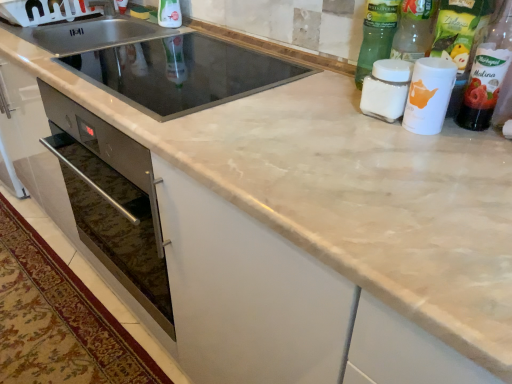
Question: Can translucent plastic bottle at upper right, which is the 1th bottle from right to left, be found inside black glass sink at center, the first sink in the front-to-back sequence?

Choices:
 (A) no
 (B) yes

Answer: (A)

Question: Is black glass sink at center, positioned as the 2th sink in back-to-front order, further to the viewer compared to translucent plastic bottle at upper right, which is the 1th bottle from right to left?

Choices:
 (A) no
 (B) yes

Answer: (B)

Question: Can you confirm if black glass sink at center, the first sink in the front-to-back sequence, is thinner than translucent plastic bottle at upper right, which is the 1th bottle from right to left?

Choices:
 (A) yes
 (B) no

Answer: (B)

Question: Does black glass sink at center, the first sink in the front-to-back sequence, have a smaller size compared to translucent plastic bottle at upper right, placed as the sixth bottle when sorted from left to right?

Choices:
 (A) no
 (B) yes

Answer: (A)

Question: Is black glass sink at center, the first sink in the front-to-back sequence, turned away from translucent plastic bottle at upper right, placed as the sixth bottle when sorted from left to right?

Choices:
 (A) yes
 (B) no

Answer: (B)

Question: From their relative heights in the image, would you say white matte cup at upper right, marked as the 4th bottle in a left-to-right arrangement, is taller or shorter than transparent plastic bottle at upper center, the first bottle when ordered from left to right?

Choices:
 (A) short
 (B) tall

Answer: (A)

Question: Looking at their shapes, would you say white matte cup at upper right, marked as the 4th bottle in a left-to-right arrangement, is wider or thinner than transparent plastic bottle at upper center, which appears as the 6th bottle when viewed from the right?

Choices:
 (A) thin
 (B) wide

Answer: (A)

Question: In the image, is white matte cup at upper right, marked as the 4th bottle in a left-to-right arrangement, on the left side or the right side of transparent plastic bottle at upper center, the first bottle when ordered from left to right?

Choices:
 (A) right
 (B) left

Answer: (A)

Question: Is white matte cup at upper right, marked as the 4th bottle in a left-to-right arrangement, in front of or behind transparent plastic bottle at upper center, the first bottle when ordered from left to right, in the image?

Choices:
 (A) front
 (B) behind

Answer: (A)

Question: Would you say green glass bottle at upper right, positioned as the fourth bottle in right-to-left order, is inside or outside transparent plastic bottle at upper center, the first bottle when ordered from left to right?

Choices:
 (A) inside
 (B) outside

Answer: (B)

Question: Considering the relative positions of green glass bottle at upper right, positioned as the fourth bottle in right-to-left order, and transparent plastic bottle at upper center, the first bottle when ordered from left to right, in the image provided, is green glass bottle at upper right, positioned as the fourth bottle in right-to-left order, to the left or to the right of transparent plastic bottle at upper center, the first bottle when ordered from left to right,?

Choices:
 (A) right
 (B) left

Answer: (A)

Question: Is green glass bottle at upper right, the 3th bottle positioned from the left, in front of or behind transparent plastic bottle at upper center, the first bottle when ordered from left to right, in the image?

Choices:
 (A) front
 (B) behind

Answer: (A)

Question: From a real-world perspective, is green glass bottle at upper right, the 3th bottle positioned from the left, above or below transparent plastic bottle at upper center, which appears as the 6th bottle when viewed from the right?

Choices:
 (A) above
 (B) below

Answer: (A)

Question: Looking at the image, does transparent plastic bottle at upper center, which appears as the 6th bottle when viewed from the right, seem bigger or smaller compared to white plastic cup at upper right, which is the 5th bottle in left-to-right order?

Choices:
 (A) big
 (B) small

Answer: (A)

Question: Choose the correct answer: Is transparent plastic bottle at upper center, the first bottle when ordered from left to right, inside white plastic cup at upper right, the second bottle positioned from the right, or outside it?

Choices:
 (A) inside
 (B) outside

Answer: (B)